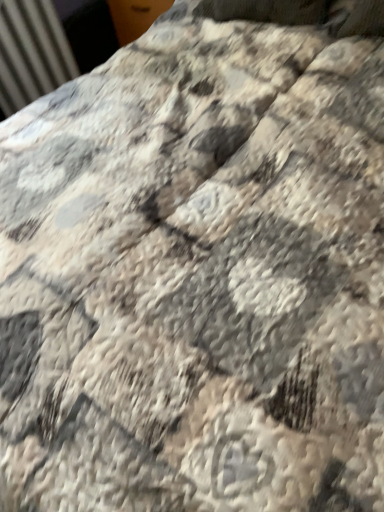
Identify the location of matte metal radiator at upper left. The height and width of the screenshot is (512, 384). (32, 52).

Describe the element at coordinates (32, 52) in the screenshot. I see `matte metal radiator at upper left` at that location.

Find the location of `matte metal radiator at upper left`. matte metal radiator at upper left is located at coordinates 32,52.